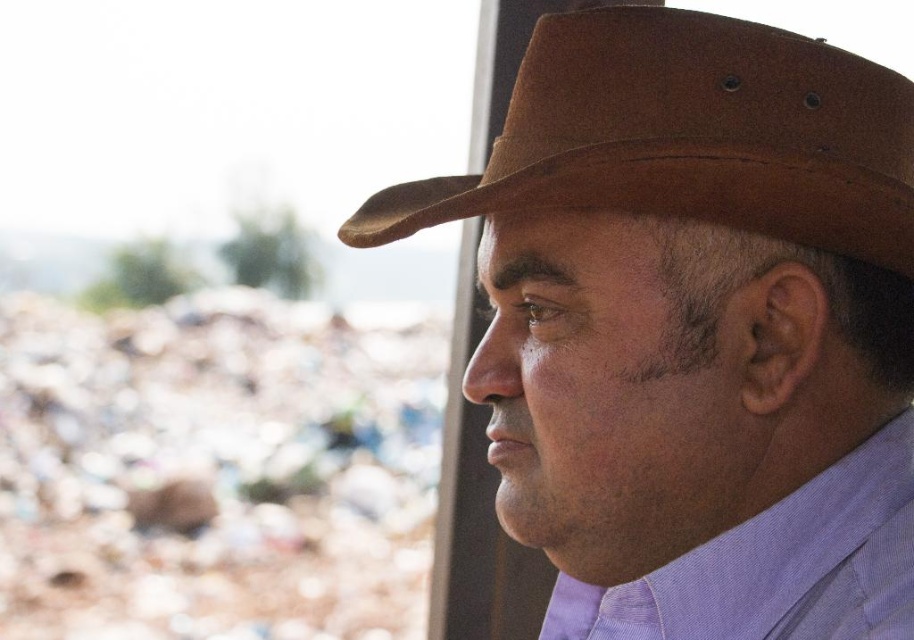
Question: Which of these objects is positioned closest to the brown leather hat at upper right?

Choices:
 (A) purple cotton dress shirt at center
 (B) brown suede cowboy hat at upper center

Answer: (B)

Question: Does brown leather hat at upper right appear under brown suede cowboy hat at upper center?

Choices:
 (A) yes
 (B) no

Answer: (A)

Question: Can you confirm if brown leather hat at upper right is positioned above purple cotton dress shirt at center?

Choices:
 (A) no
 (B) yes

Answer: (B)

Question: Which object appears closest to the camera in this image?

Choices:
 (A) brown leather hat at upper right
 (B) purple cotton dress shirt at center
 (C) brown suede cowboy hat at upper center

Answer: (C)

Question: Which object is closer to the camera taking this photo?

Choices:
 (A) brown leather hat at upper right
 (B) purple cotton dress shirt at center

Answer: (A)

Question: Is brown suede cowboy hat at upper center smaller than purple cotton dress shirt at center?

Choices:
 (A) yes
 (B) no

Answer: (B)